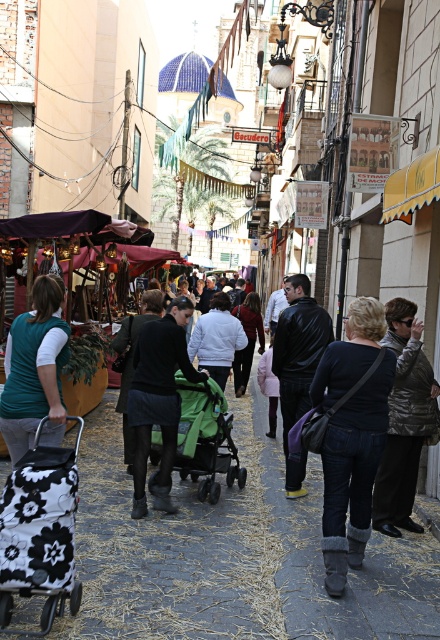
Does black and white floral fabric baby carriage at lower left come in front of teal jersey at center?

That is True.

Between black and white floral fabric baby carriage at lower left and teal jersey at center, which one has more height?

Standing taller between the two is teal jersey at center.

In order to click on black and white floral fabric baby carriage at lower left in this screenshot , I will do `click(40, 531)`.

Does leather jacket at center have a smaller size compared to green fabric stroller at center?

No.

Can you confirm if leather jacket at center is positioned to the left of green fabric stroller at center?

In fact, leather jacket at center is to the right of green fabric stroller at center.

I want to click on leather jacket at center, so [x=297, y=364].

Does shiny silver jacket at right have a smaller size compared to black matte skirt at center?

Yes, shiny silver jacket at right is smaller than black matte skirt at center.

The image size is (440, 640). Describe the element at coordinates (403, 420) in the screenshot. I see `shiny silver jacket at right` at that location.

Between point (432, 429) and point (134, 364), which one is positioned in front?

Point (432, 429) is in front.

Locate an element on the screen. shiny silver jacket at right is located at coordinates (403, 420).